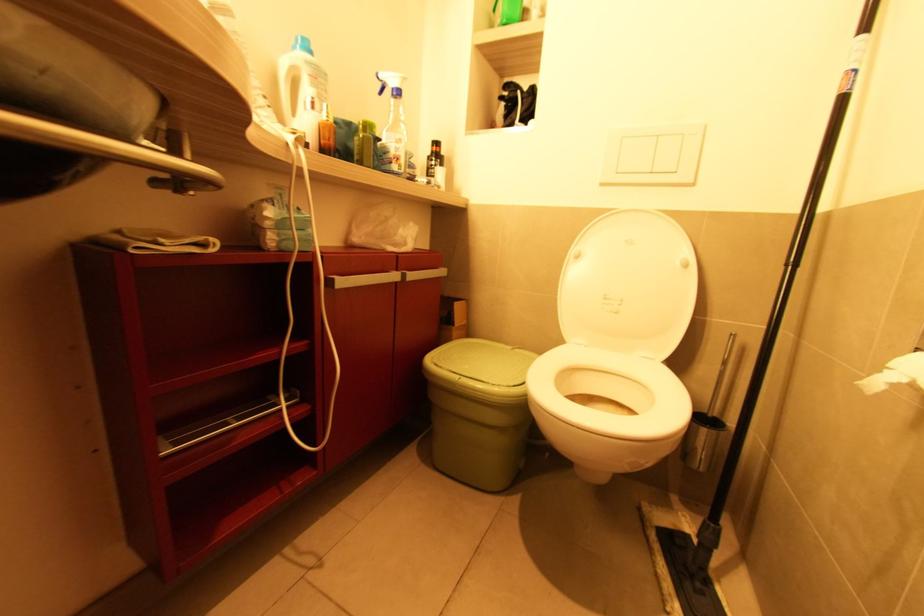
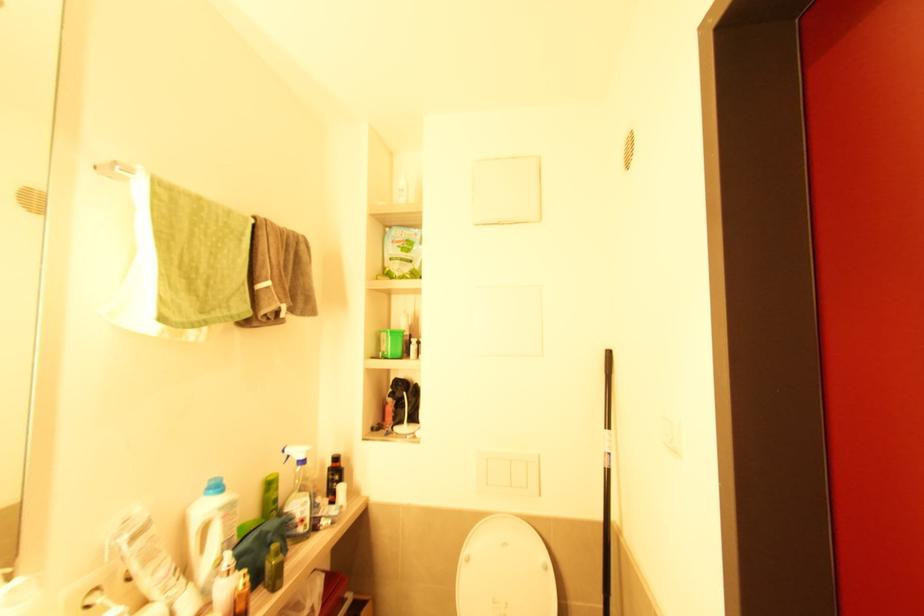
Locate, in the second image, the point that corresponds to (x=310, y=76) in the first image.

(224, 519)